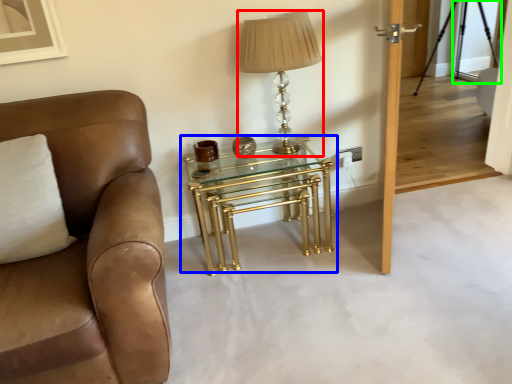
Question: Which object is positioned closest to table lamp (highlighted by a red box)? Select from table (highlighted by a blue box) and glass door (highlighted by a green box).

Choices:
 (A) table
 (B) glass door

Answer: (A)